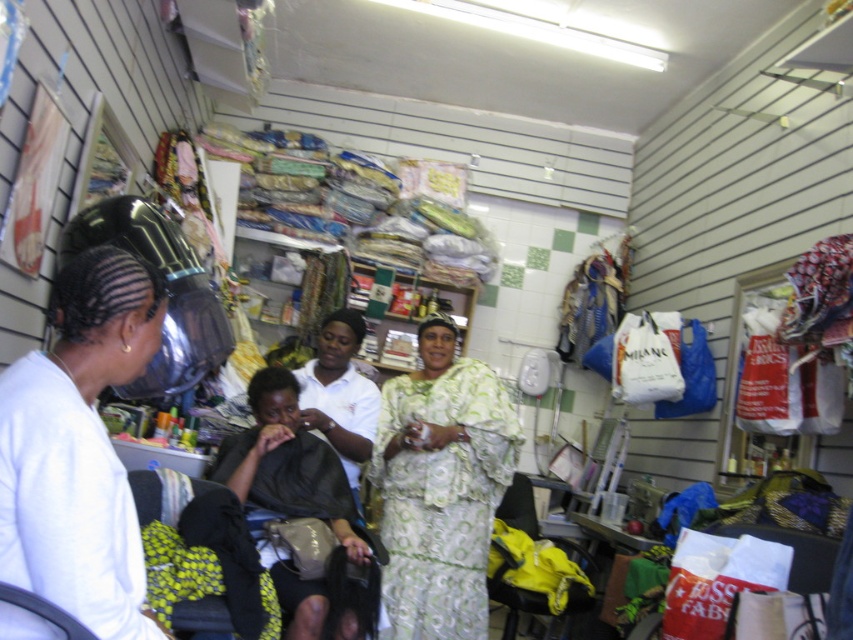
Looking at this image, you are standing in the shop and want to find the green floral fabric dress at center. According to the coordinates provided, where should you look in the image?

The green floral fabric dress at center is located at the coordinates point [442,499] in the image.

You are a delivery person who just arrived at the shop. You need to place a package that is 1.2 meters long between the white matte hair at left and the black fabric at center. Is there enough space to place it without bending the package?

The distance between the white matte hair at left and the black fabric at center is 1.06 meters. Since the package is 1.2 meters long, which is longer than the available space, it cannot be placed straight without bending.

You are a customer in the shop and want to locate the white matte hair at left. Based on the coordinates provided, where should you look in the image?

The white matte hair at left is located at the coordinates point (78, 449) in the image.